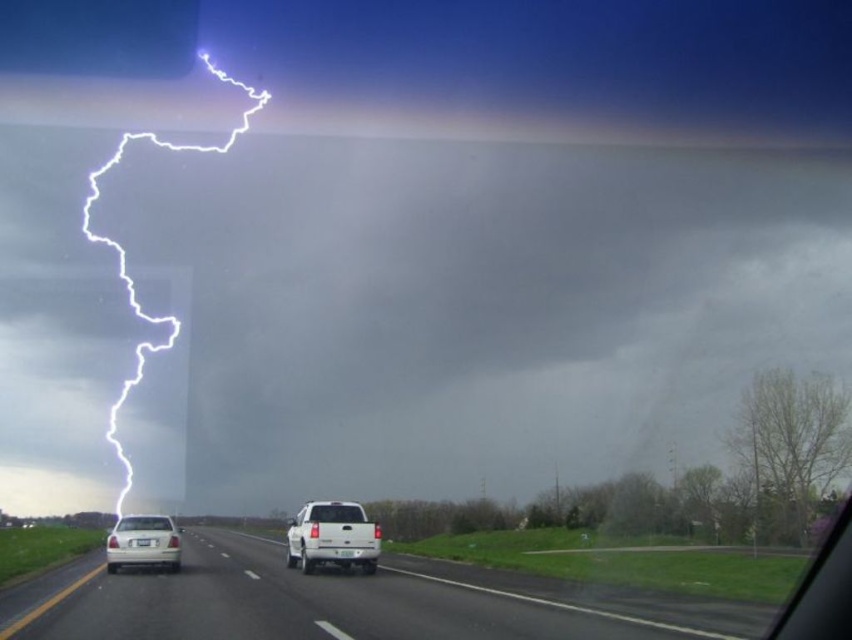
Question: Which of these objects is positioned closest to the white matte highway at center?

Choices:
 (A) matte white car window at lower left
 (B) clear glass truck at center
 (C) white matte truck at center

Answer: (C)

Question: Among these objects, which one is nearest to the camera?

Choices:
 (A) matte white car window at lower left
 (B) white matte sedan at lower left
 (C) white lightning at upper left

Answer: (A)

Question: Can you confirm if white lightning at upper left is thinner than clear glass truck at center?

Choices:
 (A) yes
 (B) no

Answer: (B)

Question: Which object appears farthest from the camera in this image?

Choices:
 (A) clear glass truck at center
 (B) white matte sedan at lower left
 (C) white lightning at upper left

Answer: (C)

Question: Can you confirm if white lightning at upper left is positioned to the left of white matte sedan at lower left?

Choices:
 (A) no
 (B) yes

Answer: (A)

Question: Is white lightning at upper left bigger than white matte sedan at lower left?

Choices:
 (A) yes
 (B) no

Answer: (A)